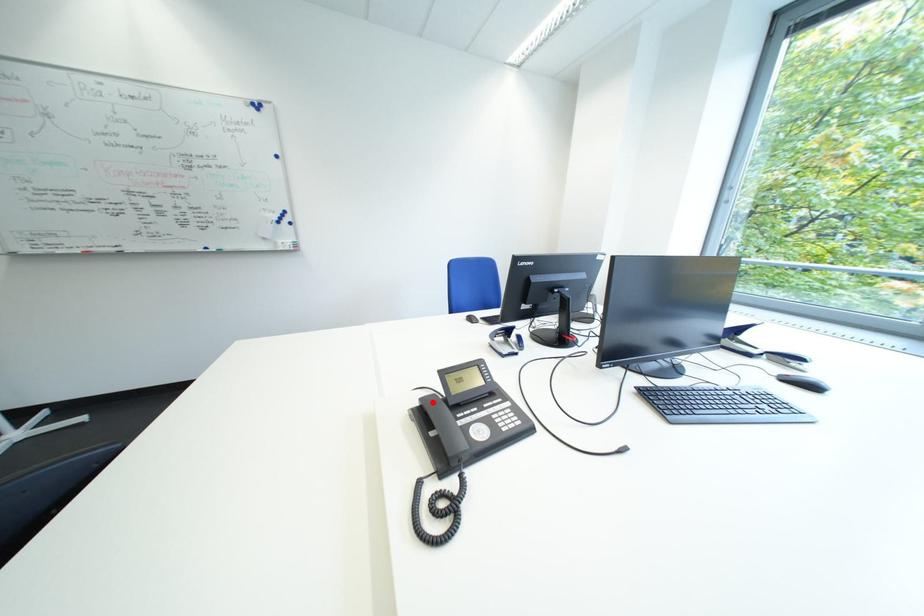
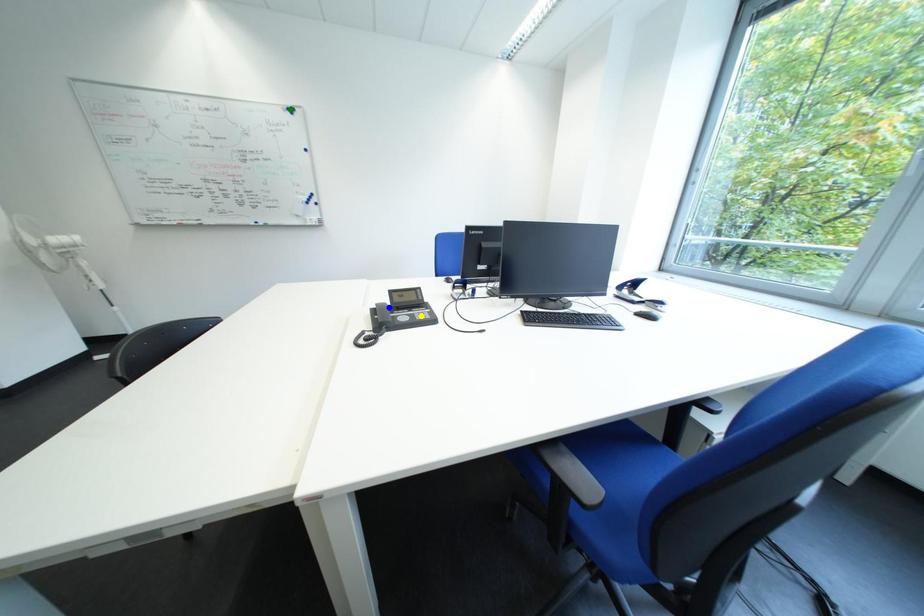
Question: I am providing you with two images of the same scene from different viewpoints. A red point is marked on the first image. You are given multiple points on the second image. Can you choose the point in image 2 that corresponds to the point in image 1?

Choices:
 (A) yellow point
 (B) blue point
 (C) green point

Answer: (B)